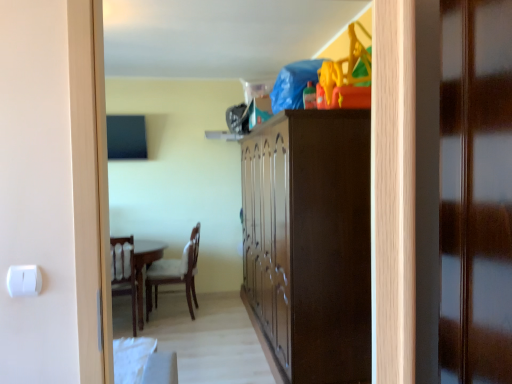
Question: Considering the positions of wooden door at right and dark wood cabinet at center in the image, is wooden door at right taller or shorter than dark wood cabinet at center?

Choices:
 (A) tall
 (B) short

Answer: (B)

Question: Looking at the image, does wooden door at right seem bigger or smaller compared to dark wood cabinet at center?

Choices:
 (A) small
 (B) big

Answer: (A)

Question: From the image's perspective, relative to dark wood cabinet at center, is wooden door at right above or below?

Choices:
 (A) above
 (B) below

Answer: (A)

Question: Relative to wooden door at right, is dark wood cabinet at center in front or behind?

Choices:
 (A) behind
 (B) front

Answer: (A)

Question: From the image's perspective, relative to wooden door at right, is dark wood cabinet at center above or below?

Choices:
 (A) below
 (B) above

Answer: (A)

Question: Based on their positions, is dark wood cabinet at center located to the left or right of wooden door at right?

Choices:
 (A) right
 (B) left

Answer: (B)

Question: Is point (365, 258) closer or farther from the camera than point (441, 299)?

Choices:
 (A) farther
 (B) closer

Answer: (A)